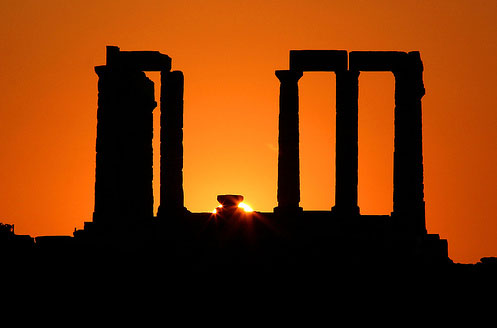
Locate an element on the screen. The height and width of the screenshot is (328, 497). pillars is located at coordinates (411, 139), (345, 141), (283, 149), (171, 147), (123, 141).